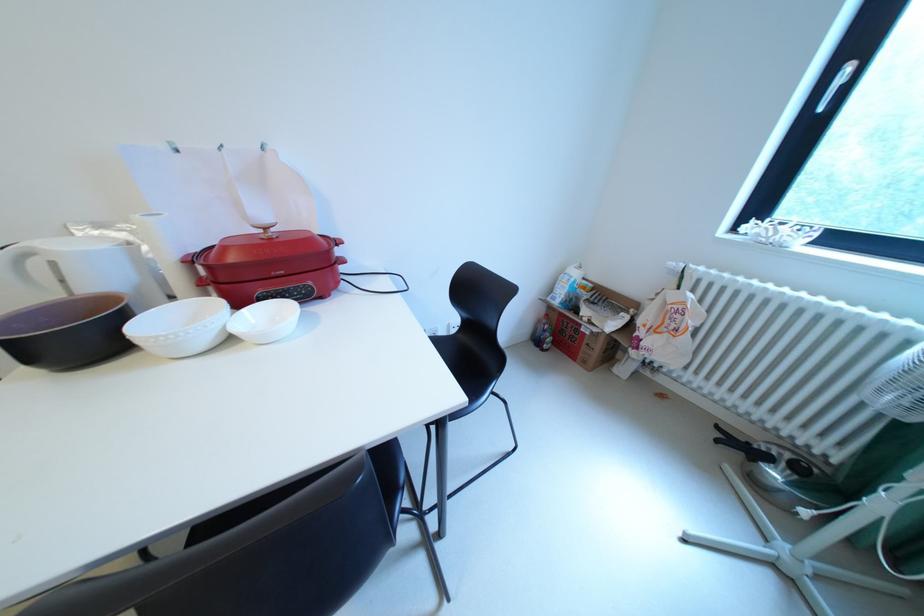
Find where to lift the small white bowl. Please return your answer as a coordinate pair (x, y).

(179, 326)